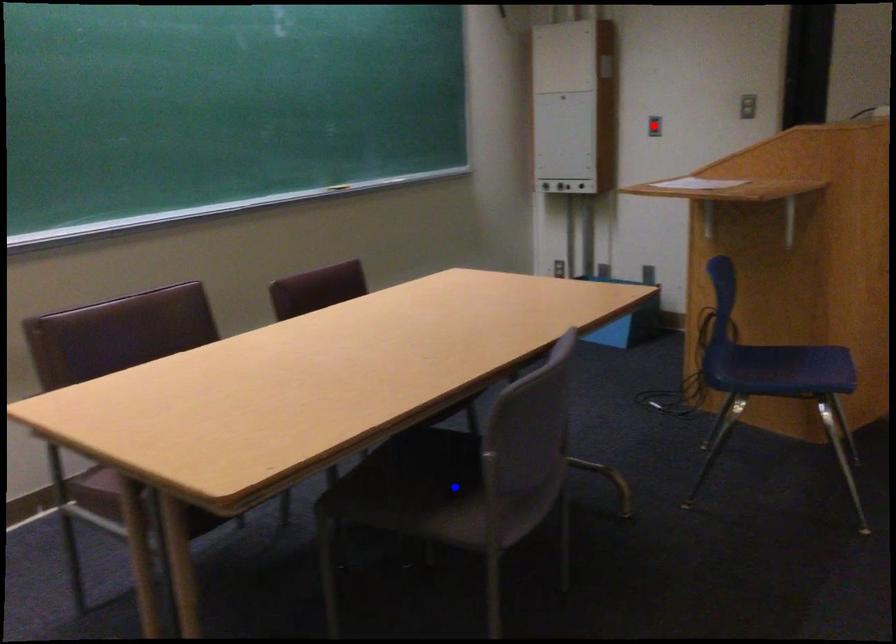
Question: In the image, two points are highlighted. Which point is nearer to the camera? Reply with the corresponding letter.

Choices:
 (A) blue point
 (B) red point

Answer: (A)